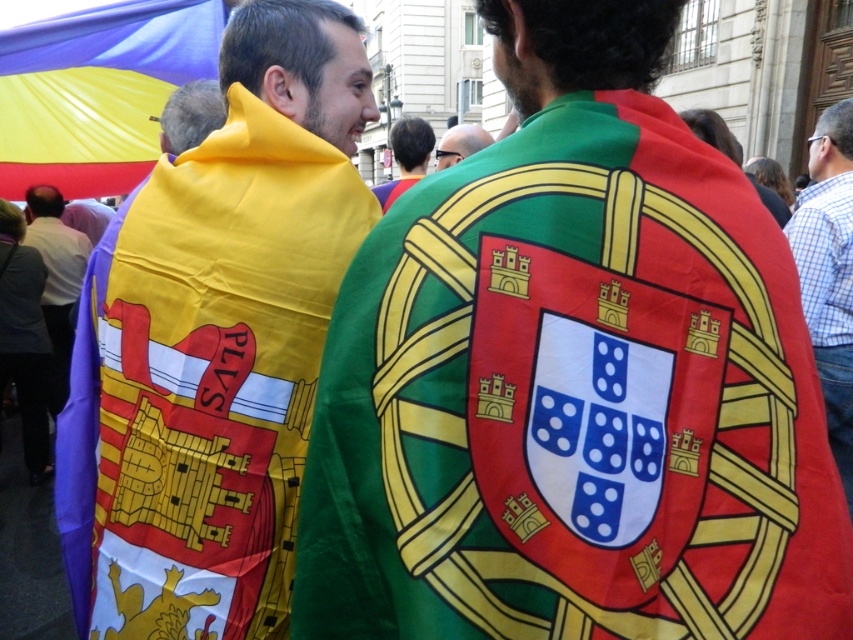
Question: Does polyester flag at center appear on the right side of matte yellow scarf at left?

Choices:
 (A) no
 (B) yes

Answer: (B)

Question: Among these objects, which one is nearest to the camera?

Choices:
 (A) green fabric headscarf at center
 (B) blue fabric flag at upper left
 (C) matte green scarf at center

Answer: (A)

Question: Which point is farther to the camera?

Choices:
 (A) (21, 68)
 (B) (62, 264)

Answer: (B)

Question: In this image, where is polyester flag at center located relative to matte black shirt at center?

Choices:
 (A) below
 (B) above

Answer: (A)

Question: Can you confirm if matte yellow scarf at left is positioned above matte black shirt at center?

Choices:
 (A) no
 (B) yes

Answer: (A)

Question: Based on their relative distances, which object is farther from the blue checkered shirt at right?

Choices:
 (A) matte black shirt at center
 (B) polyester flag at center

Answer: (A)